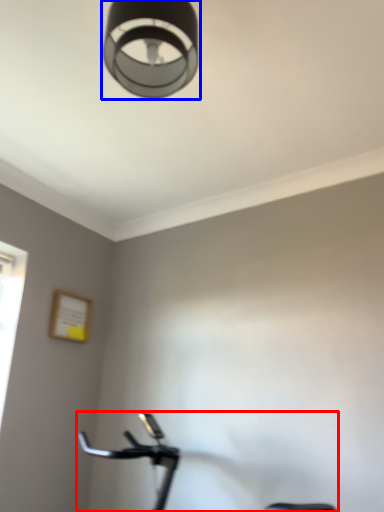
Question: Which object is closer to the camera taking this photo, stationary bicycle (highlighted by a red box) or lamp (highlighted by a blue box)?

Choices:
 (A) stationary bicycle
 (B) lamp

Answer: (B)